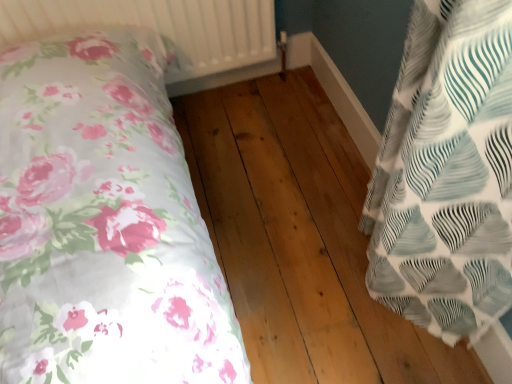
Question: Is white textured fabric pillow at right further to the viewer compared to natural wood floor at center?

Choices:
 (A) no
 (B) yes

Answer: (A)

Question: From the image's perspective, is white textured fabric pillow at right located beneath natural wood floor at center?

Choices:
 (A) no
 (B) yes

Answer: (A)

Question: From a real-world perspective, does white textured fabric pillow at right sit lower than natural wood floor at center?

Choices:
 (A) no
 (B) yes

Answer: (A)

Question: Is white textured fabric pillow at right turned away from natural wood floor at center?

Choices:
 (A) yes
 (B) no

Answer: (B)

Question: Is white textured fabric pillow at right aimed at natural wood floor at center?

Choices:
 (A) yes
 (B) no

Answer: (A)

Question: Is white textured fabric pillow at right bigger than natural wood floor at center?

Choices:
 (A) yes
 (B) no

Answer: (B)

Question: Are natural wood floor at center and white textured fabric pillow at right making contact?

Choices:
 (A) no
 (B) yes

Answer: (A)

Question: From a real-world perspective, is natural wood floor at center below white textured fabric pillow at right?

Choices:
 (A) yes
 (B) no

Answer: (A)

Question: Is natural wood floor at center positioned behind white textured fabric pillow at right?

Choices:
 (A) yes
 (B) no

Answer: (A)

Question: Considering the relative sizes of natural wood floor at center and white textured fabric pillow at right in the image provided, is natural wood floor at center wider than white textured fabric pillow at right?

Choices:
 (A) yes
 (B) no

Answer: (A)

Question: Is natural wood floor at center far away from white textured fabric pillow at right?

Choices:
 (A) yes
 (B) no

Answer: (B)

Question: Does natural wood floor at center contain white textured fabric pillow at right?

Choices:
 (A) yes
 (B) no

Answer: (B)

Question: Is white textured radiator at upper center not within white textured fabric pillow at right?

Choices:
 (A) yes
 (B) no

Answer: (A)